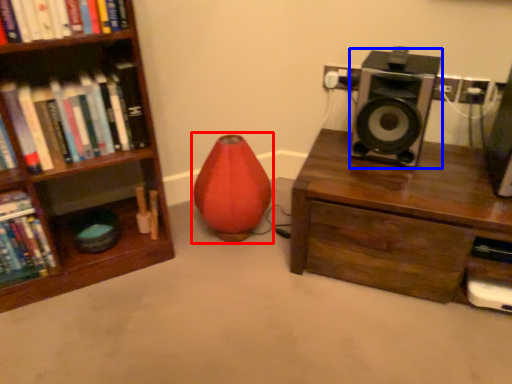
Question: Among these objects, which one is farthest to the camera, bean bag chair (highlighted by a red box) or speaker (highlighted by a blue box)?

Choices:
 (A) bean bag chair
 (B) speaker

Answer: (A)